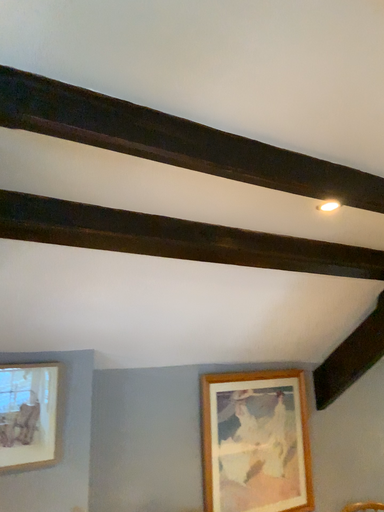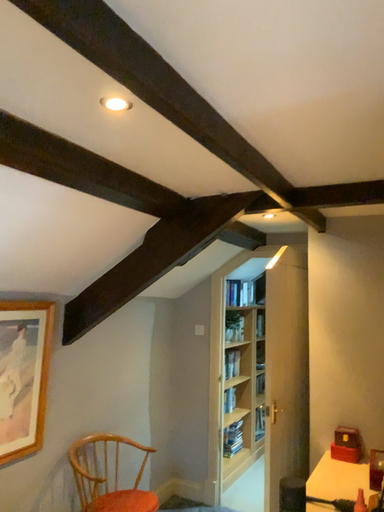
Question: Which way did the camera rotate in the video?

Choices:
 (A) rotated upward
 (B) rotated downward

Answer: (B)